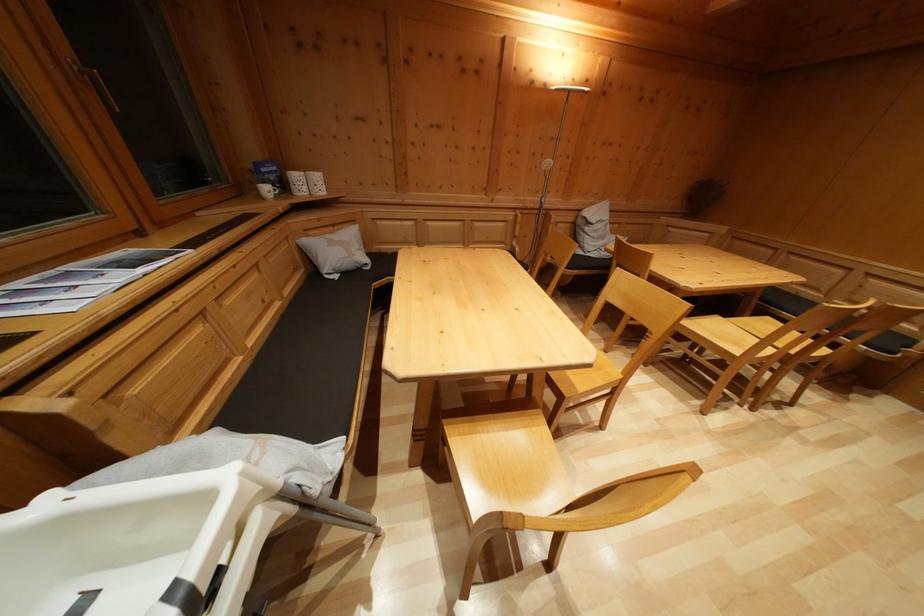
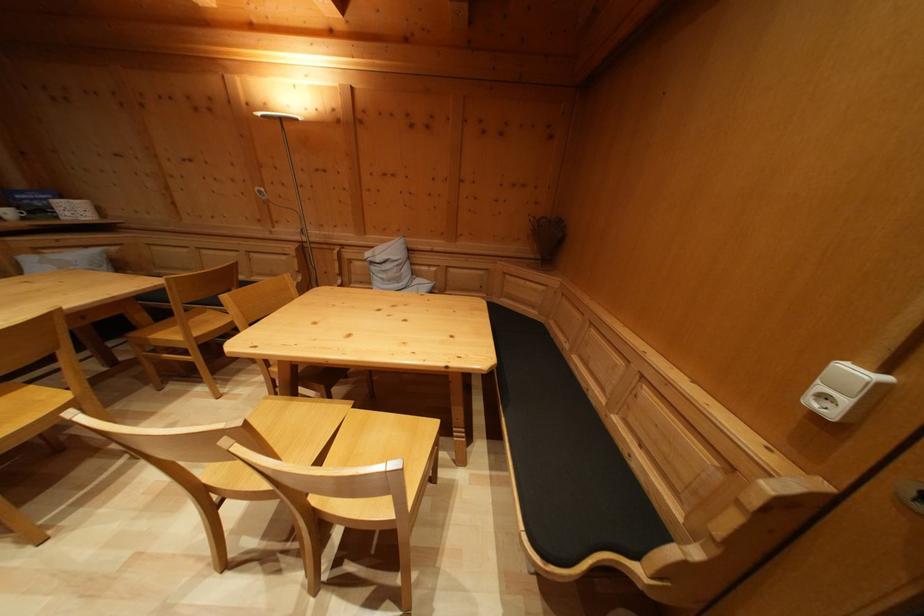
Find the pixel in the second image that matches point (273, 197) in the first image.

(14, 219)